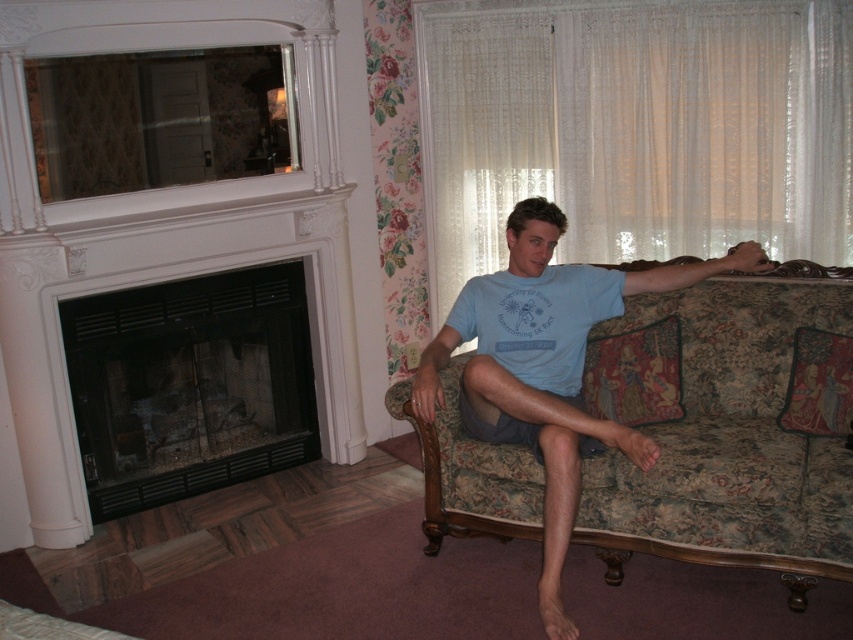
Can you confirm if floral fabric couch at right is bigger than black glass fireplace at left?

Correct, floral fabric couch at right is larger in size than black glass fireplace at left.

Does floral fabric couch at right appear over black glass fireplace at left?

No.

Which is behind, point (451, 467) or point (132, 384)?

Point (132, 384)

At what (x,y) coordinates should I click in order to perform the action: click on floral fabric couch at right. Please return your answer as a coordinate pair (x, y). This screenshot has height=640, width=853. Looking at the image, I should click on (729, 435).